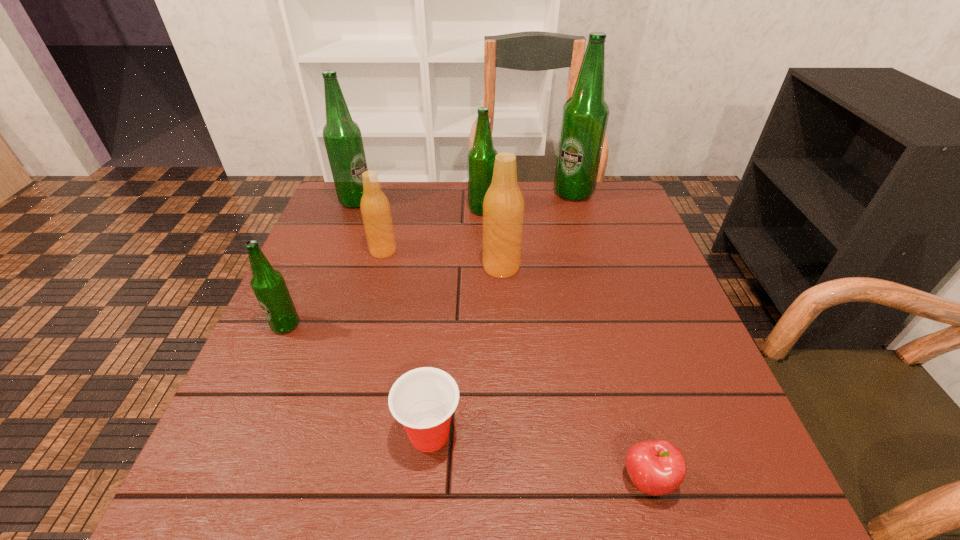
The width and height of the screenshot is (960, 540). What are the coordinates of `free space that satisfies the following two spatial constraints: 1. on the label of the rightmost beer bottle; 2. on the label of the third biggest green beer bottle` in the screenshot? It's located at 578,210.

Locate an element on the screen. This screenshot has width=960, height=540. free space that satisfies the following two spatial constraints: 1. on the label of the fifth shortest beer bottle; 2. on the right side of the cup is located at coordinates click(x=267, y=434).